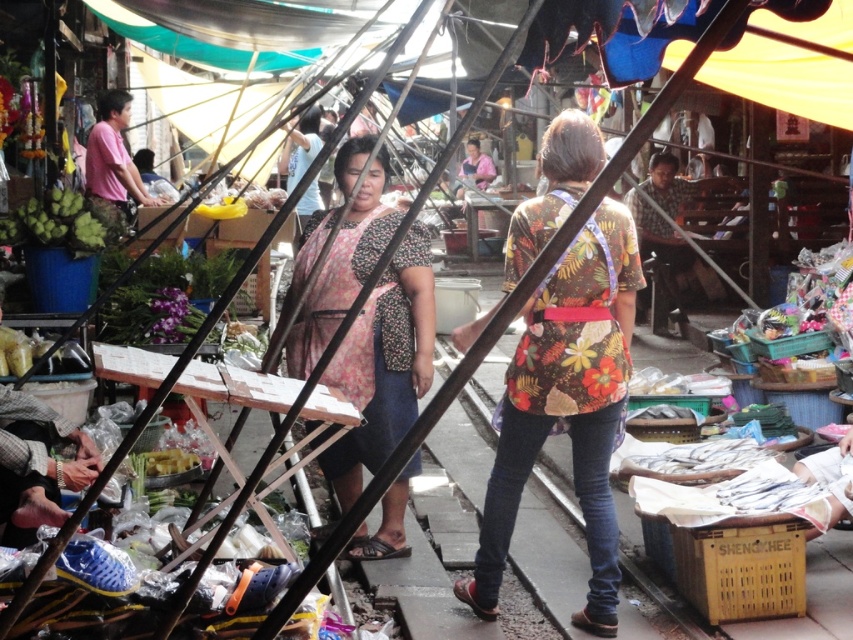
You are a customer at the market and want to buy a floral fabric shirt at center and a floral fabric dress at center. The vendor says that the shirt is much taller than the dress. Does this mean the shirt is taller than the dress?

Yes, the floral fabric shirt at center is much taller than the floral fabric dress at center, so the shirt is taller than the dress.

You are a customer at the market and want to buy a floral fabric item. You notice two items at the center of the stall. Which one is smaller in size between the floral fabric shirt at center and the floral fabric dress at center?

The floral fabric shirt at center is smaller in size compared to the floral fabric dress at center.

You are a customer at the market and want to find the shortest path to the entrance. You see two points marked in the image. The first point is at coordinate point (590, 579) and the second is at coordinate point (372, 396). Which point should you head towards to reach the entrance faster?

Point (590, 579) is in front of point (372, 396), so you should head towards point (590, 579) to reach the entrance faster.